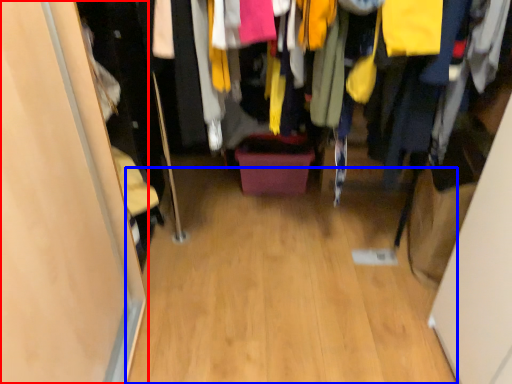
Question: Which object is closer to the camera taking this photo, door (highlighted by a red box) or plain (highlighted by a blue box)?

Choices:
 (A) door
 (B) plain

Answer: (A)